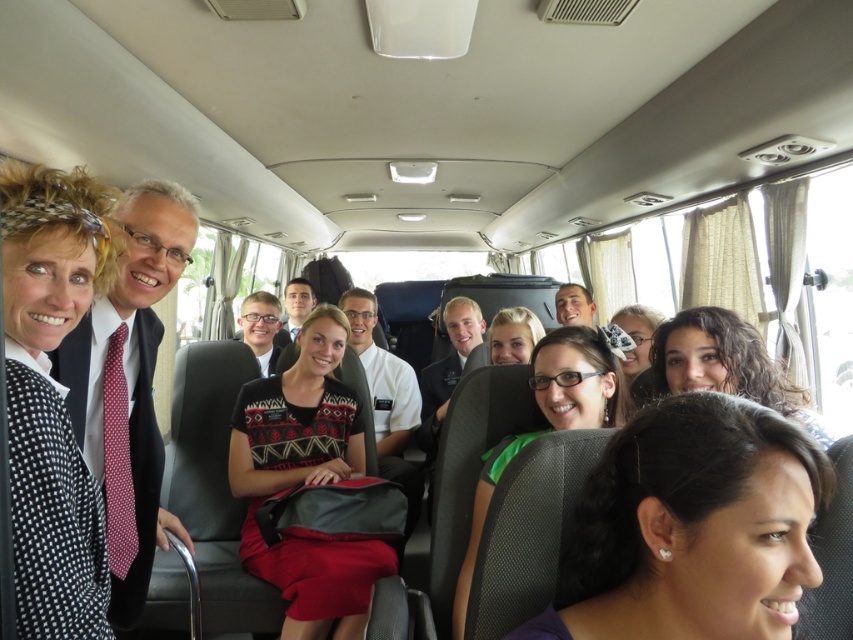
You are a passenger on the bus and you want to know which item is narrower between the red dotted tie at left and the light blue uniform at center. Which one is it?

The red dotted tie at left is thinner than the light blue uniform at center, so the red dotted tie at left is narrower.

You are a photographer taking a picture of the matte black hair at center and the smooth white shirt at center inside the bright bus. Which object is located to the right of the other?

The matte black hair at center is positioned on the right side of smooth white shirt at center, so the matte black hair at center is to the right of the smooth white shirt at center.